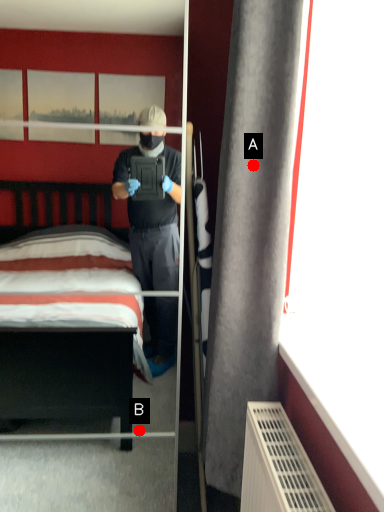
Question: Two points are circled on the image, labeled by A and B beside each circle. Which of the following is the farthest from the observer?

Choices:
 (A) A is further
 (B) B is further

Answer: (B)